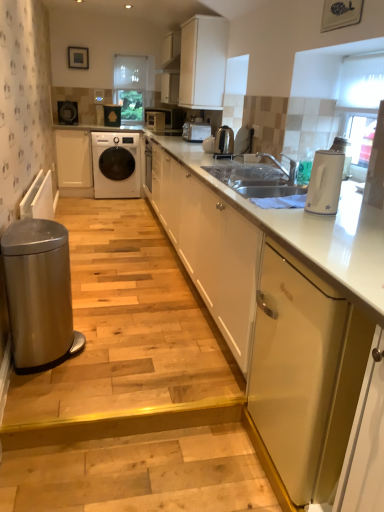
Question: In terms of size, does white glossy electric kettle at right appear bigger or smaller than white matte cabinet at upper center, the second cabinetry from the front?

Choices:
 (A) big
 (B) small

Answer: (B)

Question: From the image's perspective, is white glossy electric kettle at right located above or below white matte cabinet at upper center, which is the 2th cabinetry in back-to-front order?

Choices:
 (A) above
 (B) below

Answer: (B)

Question: Based on their relative distances, which object is nearer to the metallic silver toaster at upper center, which appears as the fifth appliance when viewed from the left?

Choices:
 (A) matte black microwave at upper center, arranged as the 2th appliance when viewed from the back
 (B) matte black microwave at upper center, positioned as the 1th appliance in top-to-bottom order
 (C) stainless steel water heater at lower left
 (D) white matte cabinet at center, arranged as the third cabinetry when viewed from the front
 (E) stainless steel trash can at lower left, arranged as the 1th stair when viewed from the back

Answer: (E)

Question: Estimate the real-world distances between objects in this image. Which object is closer to the matte black microwave at upper center, which is the third appliance from bottom to top?

Choices:
 (A) stainless steel water heater at lower left
 (B) stainless steel trash can at lower left, arranged as the 1th stair when viewed from the back
 (C) white frosted glass window at upper right
 (D) white fabric at center
 (E) white glossy cabinet at center, positioned as the 1th cabinetry in front-to-back order

Answer: (D)